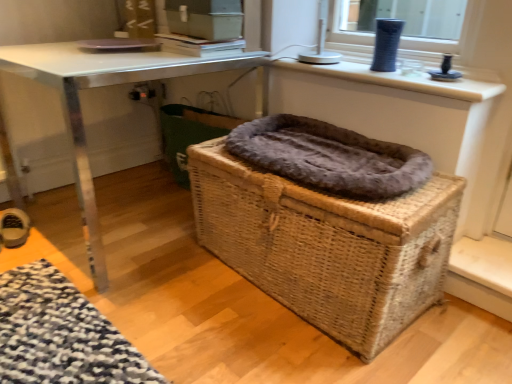
Question: Considering the relative positions of leather shoe at lower left and metallic silver table at center in the image provided, is leather shoe at lower left behind metallic silver table at center?

Choices:
 (A) no
 (B) yes

Answer: (B)

Question: Is leather shoe at lower left positioned beyond the bounds of metallic silver table at center?

Choices:
 (A) yes
 (B) no

Answer: (A)

Question: Can you confirm if leather shoe at lower left is thinner than metallic silver table at center?

Choices:
 (A) yes
 (B) no

Answer: (A)

Question: Considering the relative sizes of leather shoe at lower left and metallic silver table at center in the image provided, is leather shoe at lower left smaller than metallic silver table at center?

Choices:
 (A) yes
 (B) no

Answer: (A)

Question: Is metallic silver table at center surrounded by leather shoe at lower left?

Choices:
 (A) yes
 (B) no

Answer: (B)

Question: From the image's perspective, is leather shoe at lower left over metallic silver table at center?

Choices:
 (A) yes
 (B) no

Answer: (B)

Question: Can you see fuzzy gray blanket at center touching metallic silver table at center?

Choices:
 (A) yes
 (B) no

Answer: (B)

Question: From the image's perspective, is fuzzy gray blanket at center on metallic silver table at center?

Choices:
 (A) no
 (B) yes

Answer: (A)

Question: Is fuzzy gray blanket at center further to camera compared to metallic silver table at center?

Choices:
 (A) yes
 (B) no

Answer: (B)

Question: Is fuzzy gray blanket at center positioned before metallic silver table at center?

Choices:
 (A) no
 (B) yes

Answer: (B)

Question: Does fuzzy gray blanket at center appear on the left side of metallic silver table at center?

Choices:
 (A) no
 (B) yes

Answer: (A)

Question: Considering the relative sizes of fuzzy gray blanket at center and metallic silver table at center in the image provided, is fuzzy gray blanket at center bigger than metallic silver table at center?

Choices:
 (A) no
 (B) yes

Answer: (A)

Question: Is matte blue vase at upper right a part of fuzzy brown laundry basket at center?

Choices:
 (A) no
 (B) yes

Answer: (A)